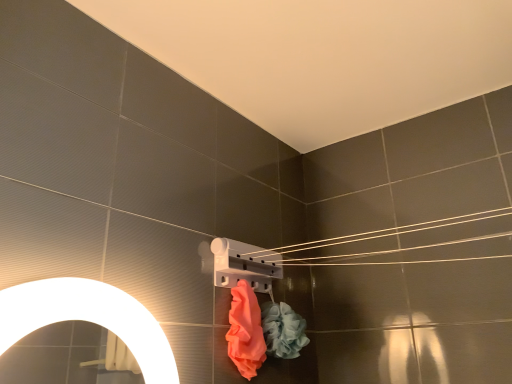
This screenshot has width=512, height=384. What do you see at coordinates (245, 331) in the screenshot?
I see `matte orange towel at center` at bounding box center [245, 331].

Identify the location of matte orange towel at center. The width and height of the screenshot is (512, 384). (245, 331).

Find the location of `matte orange towel at center`. matte orange towel at center is located at coordinates (245, 331).